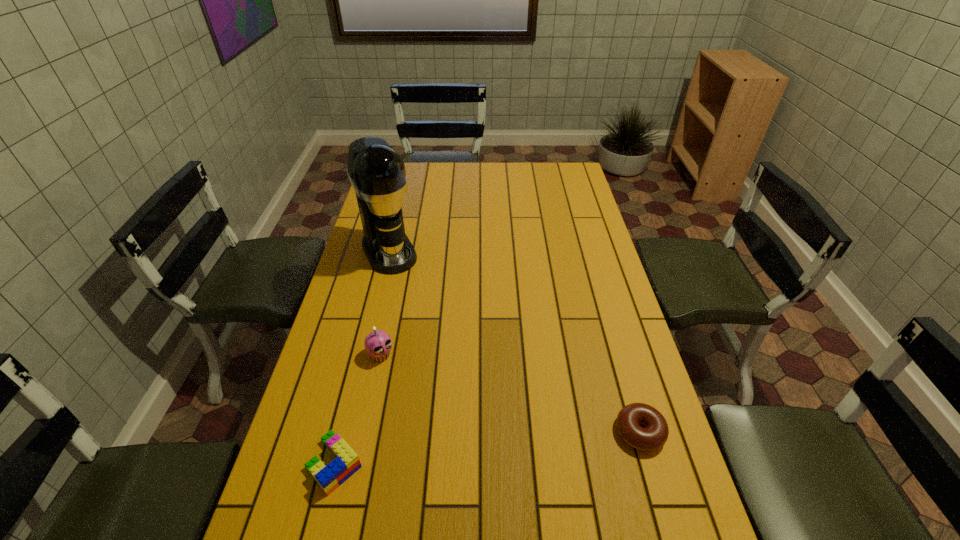
Locate an element on the screen. The image size is (960, 540). blank area at the right edge is located at coordinates (559, 212).

Identify the location of vacant area between the third nearest object and the rightmost object. This screenshot has width=960, height=540. tap(511, 394).

This screenshot has width=960, height=540. What are the coordinates of `vacant area that lies between the Lego and the cupcake` in the screenshot? It's located at (358, 409).

Identify the location of unoccupied area between the rightmost object and the Lego. (488, 448).

In order to click on vacant space that is in between the second tallest object and the doughnut in this screenshot , I will do [x=511, y=394].

This screenshot has height=540, width=960. Identify the location of blank region between the doughnut and the coffee maker. (515, 341).

The width and height of the screenshot is (960, 540). Find the location of `empty location between the Lego and the tallest object`. empty location between the Lego and the tallest object is located at coordinates (362, 357).

Where is `vacant area that lies between the third nearest object and the coffee maker`? The width and height of the screenshot is (960, 540). vacant area that lies between the third nearest object and the coffee maker is located at coordinates (385, 303).

Locate an element on the screen. The width and height of the screenshot is (960, 540). blank region between the Lego and the rightmost object is located at coordinates (488, 448).

The height and width of the screenshot is (540, 960). I want to click on free space between the tallest object and the Lego, so click(x=362, y=357).